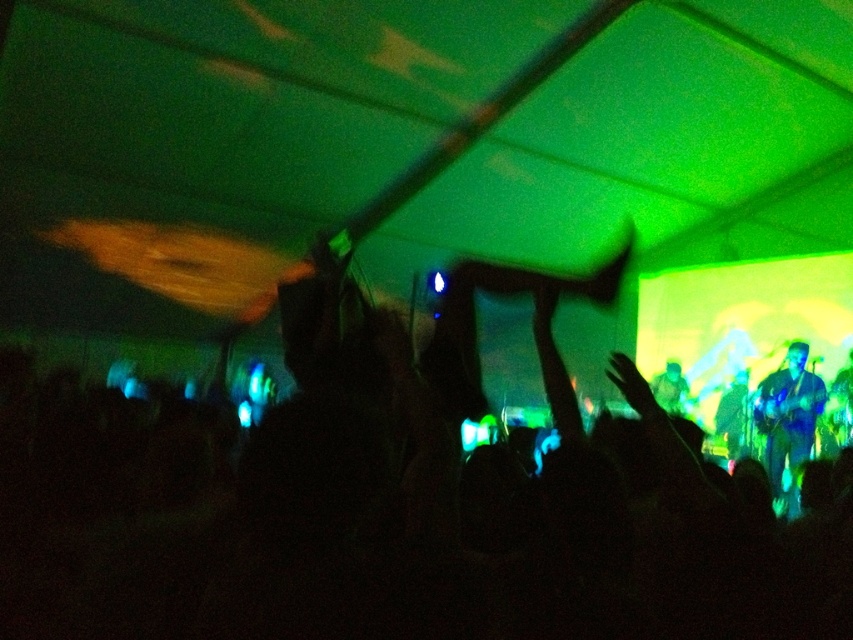
Question: Does silhouette of person at center appear on the right side of blue metallic guitar at right?

Choices:
 (A) yes
 (B) no

Answer: (B)

Question: Is silhouette of person at center smaller than blue metallic guitar at right?

Choices:
 (A) no
 (B) yes

Answer: (A)

Question: Can you confirm if silhouette of person at center is bigger than blue metallic guitar at right?

Choices:
 (A) yes
 (B) no

Answer: (A)

Question: Among these objects, which one is nearest to the camera?

Choices:
 (A) blue metallic guitar at right
 (B) silhouette of person at center

Answer: (B)

Question: Which point is farther from the camera taking this photo?

Choices:
 (A) (386, 525)
 (B) (786, 378)

Answer: (B)

Question: Which point appears closest to the camera in this image?

Choices:
 (A) (73, 408)
 (B) (757, 429)

Answer: (A)